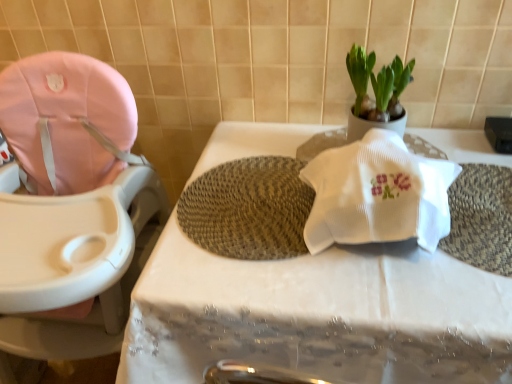
Question: Is woven beige bath mat at center thinner than pink fabric baby carriage at left?

Choices:
 (A) yes
 (B) no

Answer: (A)

Question: From a real-world perspective, is woven beige bath mat at center located higher than pink fabric baby carriage at left?

Choices:
 (A) no
 (B) yes

Answer: (B)

Question: From the image's perspective, is woven beige bath mat at center on top of pink fabric baby carriage at left?

Choices:
 (A) no
 (B) yes

Answer: (B)

Question: Is woven beige bath mat at center far from pink fabric baby carriage at left?

Choices:
 (A) yes
 (B) no

Answer: (B)

Question: Is woven beige bath mat at center to the left of pink fabric baby carriage at left from the viewer's perspective?

Choices:
 (A) no
 (B) yes

Answer: (A)

Question: Is woven beige bath mat at center facing towards pink fabric baby carriage at left?

Choices:
 (A) no
 (B) yes

Answer: (A)

Question: Is woven beige bath mat at center with white matte pot at upper right?

Choices:
 (A) yes
 (B) no

Answer: (B)

Question: Is woven beige bath mat at center oriented away from white matte pot at upper right?

Choices:
 (A) no
 (B) yes

Answer: (A)

Question: Is woven beige bath mat at center positioned before white matte pot at upper right?

Choices:
 (A) yes
 (B) no

Answer: (A)

Question: Could you tell me if woven beige bath mat at center is facing white matte pot at upper right?

Choices:
 (A) yes
 (B) no

Answer: (B)

Question: From the image's perspective, would you say woven beige bath mat at center is shown under white matte pot at upper right?

Choices:
 (A) yes
 (B) no

Answer: (A)

Question: Considering the relative sizes of woven beige bath mat at center and white matte pot at upper right in the image provided, is woven beige bath mat at center shorter than white matte pot at upper right?

Choices:
 (A) yes
 (B) no

Answer: (A)

Question: From a real-world perspective, is white matte pot at upper right on pink fabric baby carriage at left?

Choices:
 (A) no
 (B) yes

Answer: (B)